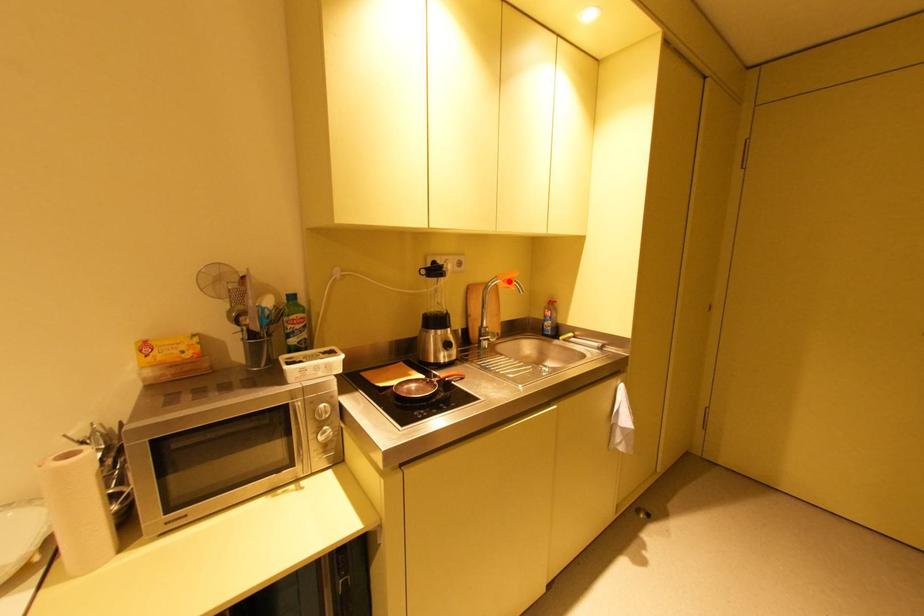
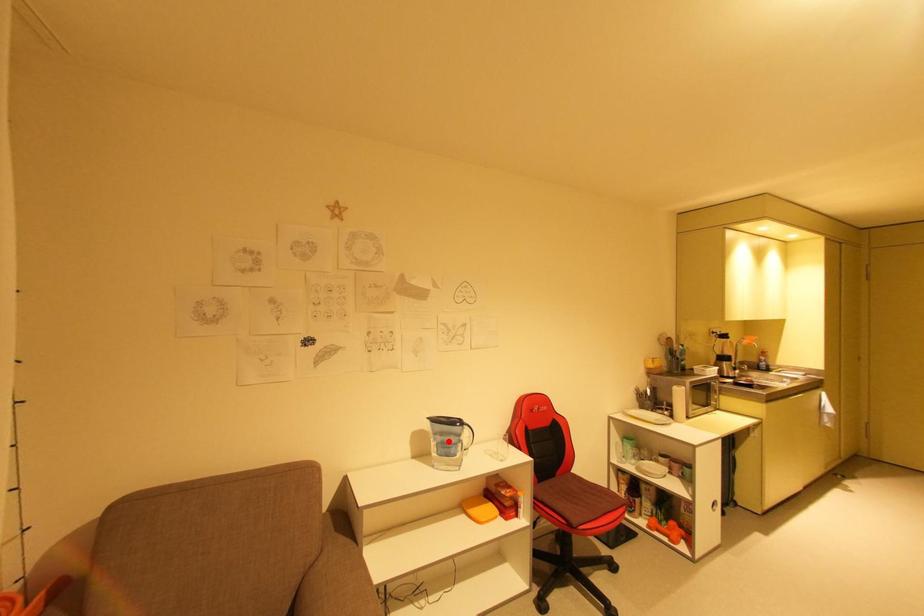
I am providing you with two images of the same scene from different viewpoints. A red point is marked on the first image and another point is marked on the second image. Do the highlighted points in image1 and image2 indicate the same real-world spot?

No